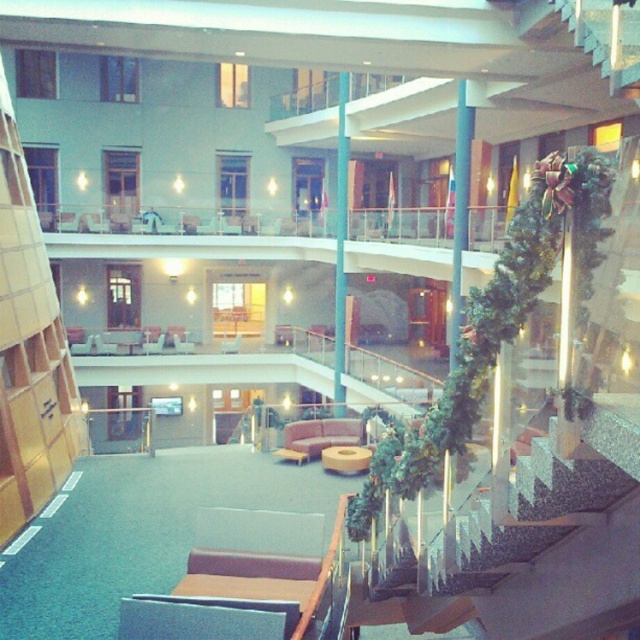
Question: Which object is closer to the camera taking this photo?

Choices:
 (A) blue glossy pillar at center
 (B) matte brown chair at center

Answer: (A)

Question: Can you confirm if blue glossy pillar at center is thinner than matte brown chair at center?

Choices:
 (A) no
 (B) yes

Answer: (B)

Question: Is blue glossy pillar at center closer to the viewer compared to matte brown chair at center?

Choices:
 (A) no
 (B) yes

Answer: (B)

Question: Which point is farther to the camera?

Choices:
 (A) (342, 100)
 (B) (232, 348)

Answer: (B)

Question: Does blue glossy pillar at center appear on the right side of matte brown chair at center?

Choices:
 (A) no
 (B) yes

Answer: (B)